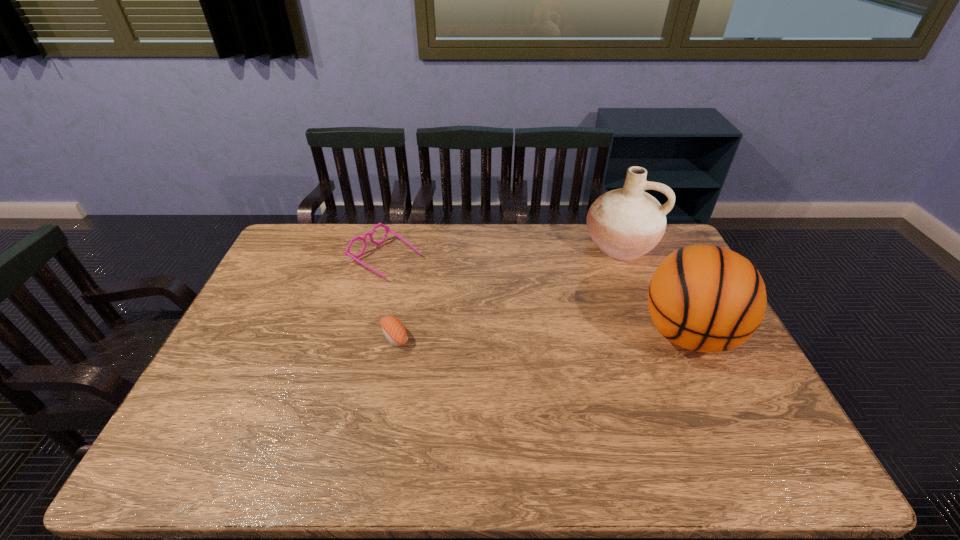
Where is `vacant region at the right edge of the desktop`? The width and height of the screenshot is (960, 540). vacant region at the right edge of the desktop is located at coordinates (726, 371).

Locate an element on the screen. empty space between the pottery and the spectacles is located at coordinates (503, 252).

At what (x,y) coordinates should I click in order to perform the action: click on empty space between the pottery and the second shortest object. Please return your answer as a coordinate pair (x, y). This screenshot has height=540, width=960. Looking at the image, I should click on (503, 252).

Where is `vacant area that lies between the sushi and the pottery`? vacant area that lies between the sushi and the pottery is located at coordinates (507, 291).

Locate an element on the screen. The image size is (960, 540). vacant point located between the pottery and the sushi is located at coordinates (507, 291).

This screenshot has height=540, width=960. Identify the location of vacant space that is in between the basketball and the spectacles. (537, 296).

This screenshot has width=960, height=540. I want to click on vacant space in between the basketball and the second shortest object, so click(x=537, y=296).

What are the coordinates of `vacant region between the basketball and the shortest object` in the screenshot? It's located at (541, 335).

You are a GUI agent. You are given a task and a screenshot of the screen. Output one action in this format:
    pyautogui.click(x=<x>, y=<y>)
    Task: Click on the vacant space in between the basketball and the spectacles
    This screenshot has width=960, height=540.
    Given the screenshot: What is the action you would take?
    pyautogui.click(x=537, y=296)

You are a GUI agent. You are given a task and a screenshot of the screen. Output one action in this format:
    pyautogui.click(x=<x>, y=<y>)
    Task: Click on the vacant area between the second shortest object and the basketball
    The width and height of the screenshot is (960, 540).
    Given the screenshot: What is the action you would take?
    pyautogui.click(x=537, y=296)